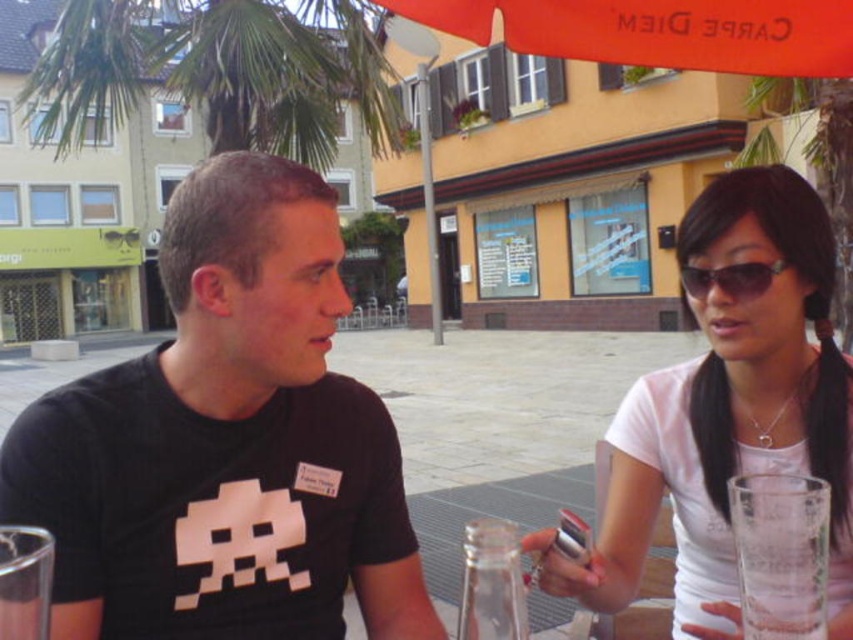
Is point (706, 435) positioned in front of point (45, 132)?

Yes, it is in front of point (45, 132).

Is white matte shirt at right thinner than green leafy palm tree at upper left?

Correct, white matte shirt at right's width is less than green leafy palm tree at upper left's.

Is point (697, 621) behind point (337, 88)?

No, it is not.

This screenshot has height=640, width=853. Find the location of `white matte shirt at right`. white matte shirt at right is located at coordinates (728, 413).

Between point (816, 307) and point (790, 557), which one is positioned behind?

The point (816, 307) is behind.

Where is `white matte shirt at right`? This screenshot has height=640, width=853. white matte shirt at right is located at coordinates (728, 413).

Is black matte t-shirt at center above green leafy palm tree at upper left?

Incorrect, black matte t-shirt at center is not positioned above green leafy palm tree at upper left.

The height and width of the screenshot is (640, 853). I want to click on black matte t-shirt at center, so pos(225,442).